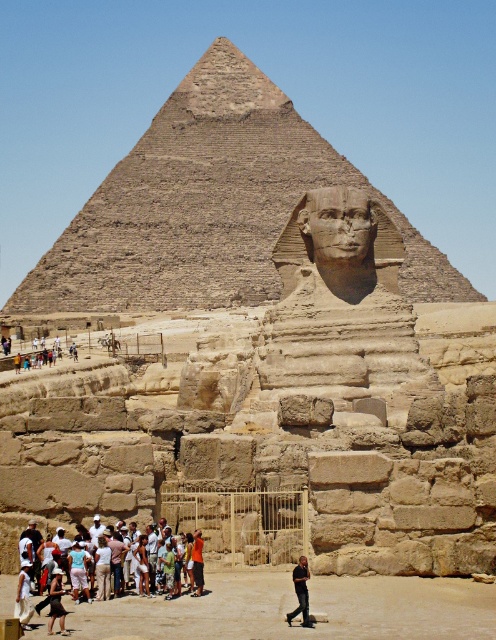
Is brown stone pyramid at center closer to the viewer compared to white cotton shirt at lower left?

No, brown stone pyramid at center is further to the viewer.

Locate an element on the screen. Image resolution: width=496 pixels, height=640 pixels. brown stone pyramid at center is located at coordinates (209, 205).

Find the location of `brown stone pyramid at center`. brown stone pyramid at center is located at coordinates (209, 205).

I want to click on brown stone pyramid at center, so click(x=209, y=205).

Is white cotton shirt at lower left bigger than dark brown leather pants at lower center?

Yes, white cotton shirt at lower left is bigger than dark brown leather pants at lower center.

Who is more forward, (283, 588) or (287, 616)?

Point (287, 616) is more forward.

Is point (112, 630) closer to viewer compared to point (300, 564)?

Yes.

In order to click on white cotton shirt at lower left in this screenshot , I will do `click(189, 611)`.

Between brown stone pyramid at center and dark brown leather pants at lower center, which one appears on the right side from the viewer's perspective?

dark brown leather pants at lower center

The image size is (496, 640). What do you see at coordinates (209, 205) in the screenshot?
I see `brown stone pyramid at center` at bounding box center [209, 205].

Where is `brown stone pyramid at center`? brown stone pyramid at center is located at coordinates (209, 205).

Identify the location of brown stone pyramid at center. (209, 205).